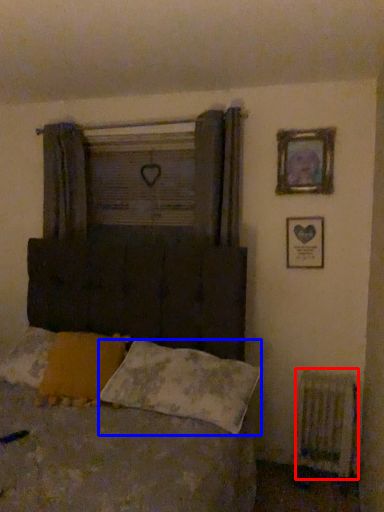
Question: Which of the following is the closest to the observer, radiator (highlighted by a red box) or pillow (highlighted by a blue box)?

Choices:
 (A) radiator
 (B) pillow

Answer: (B)